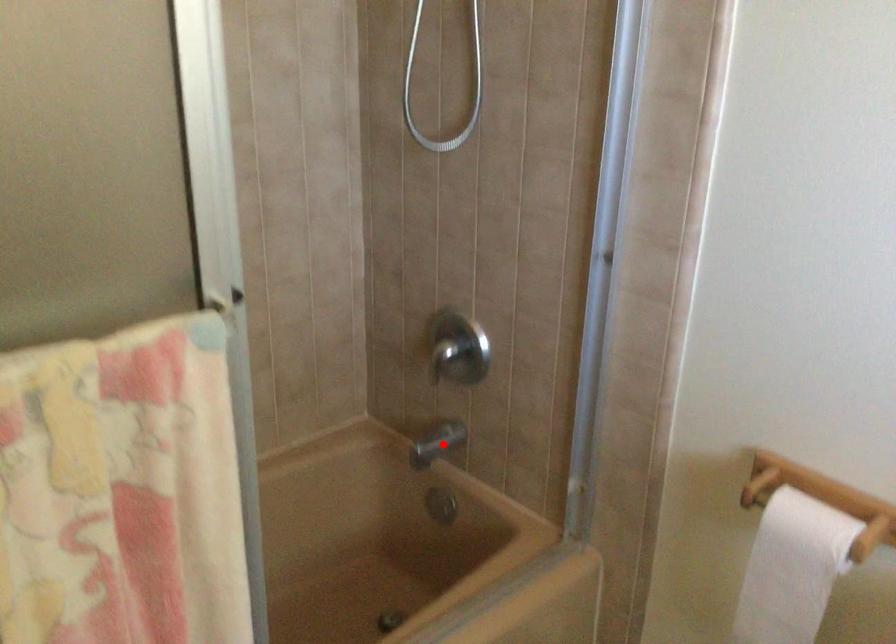
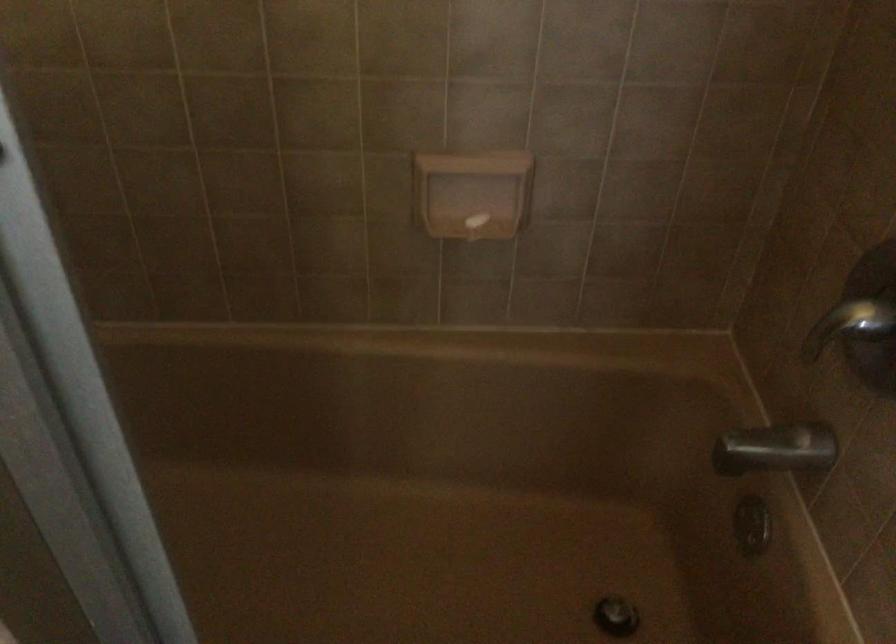
Question: I am providing you with two images of the same scene from different viewpoints. Given a red point in image1, look at the same physical point in image2. Is it:

Choices:
 (A) Closer to the viewpoint
 (B) Farther from the viewpoint

Answer: (A)